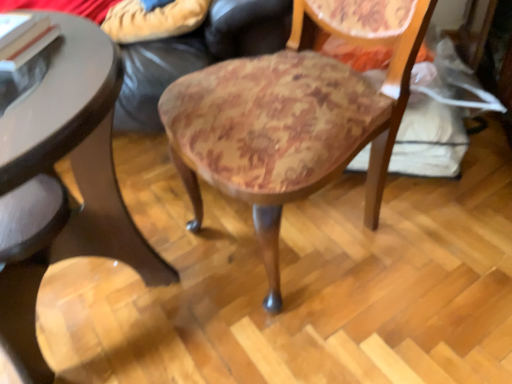
Locate an element on the screen. The height and width of the screenshot is (384, 512). vacant area that lies to the right of wooden upholstered chair at center is located at coordinates (443, 243).